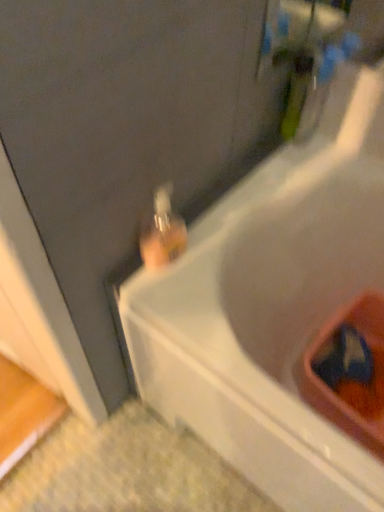
Question: From the image's perspective, is translucent glass bottle at upper center above or below white plastic bathtub at upper right?

Choices:
 (A) above
 (B) below

Answer: (A)

Question: Is translucent glass bottle at upper center wider or thinner than white plastic bathtub at upper right?

Choices:
 (A) wide
 (B) thin

Answer: (B)

Question: Choose the correct answer: Is translucent glass bottle at upper center inside white plastic bathtub at upper right or outside it?

Choices:
 (A) outside
 (B) inside

Answer: (A)

Question: From a real-world perspective, is white plastic bathtub at upper right above or below translucent glass bottle at upper center?

Choices:
 (A) below
 (B) above

Answer: (A)

Question: From the image's perspective, relative to translucent glass bottle at upper center, is white plastic bathtub at upper right above or below?

Choices:
 (A) below
 (B) above

Answer: (A)

Question: Looking at the image, does white plastic bathtub at upper right seem bigger or smaller compared to translucent glass bottle at upper center?

Choices:
 (A) big
 (B) small

Answer: (A)

Question: Based on their positions, is white plastic bathtub at upper right located to the left or right of translucent glass bottle at upper center?

Choices:
 (A) right
 (B) left

Answer: (A)